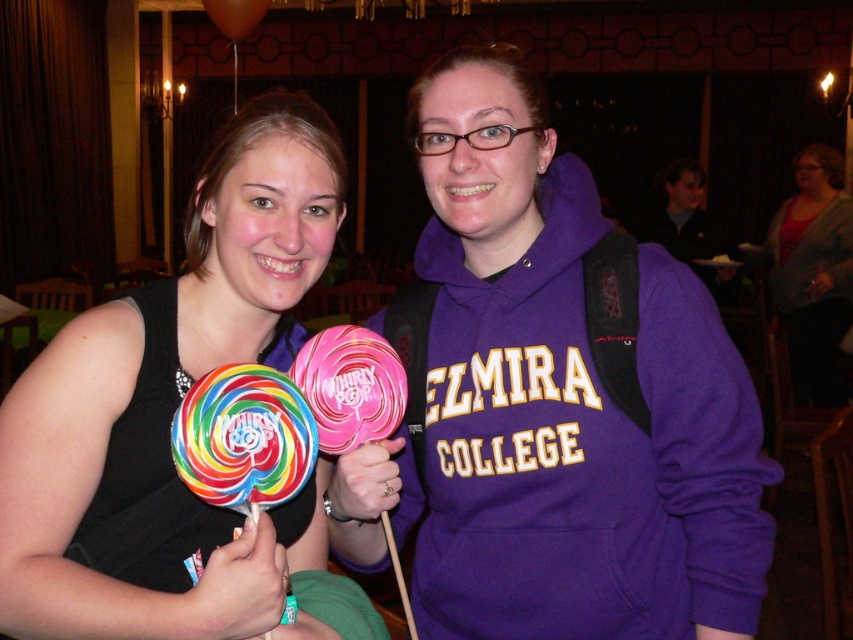
Who is lower down, purple matte hoodie at center or matte pink lollipop at center?

matte pink lollipop at center is lower down.

Is purple matte hoodie at center to the left of matte pink lollipop at center from the viewer's perspective?

In fact, purple matte hoodie at center is to the right of matte pink lollipop at center.

Who is more forward, (602, 253) or (329, 413)?

Point (329, 413)

Find the location of a particular element. The image size is (853, 640). purple matte hoodie at center is located at coordinates (554, 401).

Between rainbow lollipop at center and matte pink lollipop at center, which one has less height?

matte pink lollipop at center

At what (x,y) coordinates should I click in order to perform the action: click on rainbow lollipop at center. Please return your answer as a coordinate pair (x, y). Looking at the image, I should click on (244, 438).

This screenshot has width=853, height=640. I want to click on rainbow lollipop at center, so click(x=244, y=438).

Is matte black dress at left shorter than rainbow lollipop at center?

Incorrect, matte black dress at left's height does not fall short of rainbow lollipop at center's.

Between point (187, 371) and point (279, 417), which one is positioned in front?

Point (279, 417) is more forward.

Describe the element at coordinates (171, 401) in the screenshot. I see `matte black dress at left` at that location.

At what (x,y) coordinates should I click in order to perform the action: click on matte black dress at left. Please return your answer as a coordinate pair (x, y). Looking at the image, I should click on (171, 401).